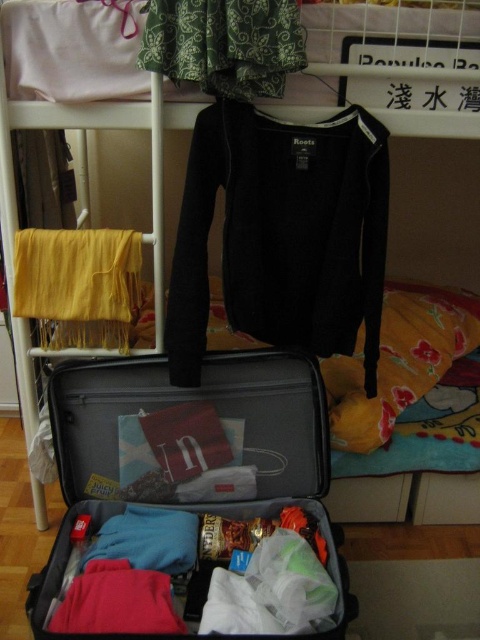
In the scene shown: You are packing your suitcase and need to know which item is shorter between the patterned fabric pants at upper center and the yellow fabric at left. Can you tell me which one is shorter?

The patterned fabric pants at upper center has a lesser height compared to yellow fabric at left, so the patterned fabric pants at upper center is shorter.

You are a delivery robot with a height of 1.2 meters. You need to deliver a package to the dorm room. The package is placed on the floor in front of the matte gray suitcase at center. Can you see the package from your current position?

The distance between the matte gray suitcase at center and the camera is 1.11 meters. Since the robot is 1.2 meters tall, it can see over the suitcase and thus see the package on the floor in front of it.

You are moving into a dormitory and need to place your belongings. You have a matte gray suitcase at center and patterned fabric pants at upper center. Which item is located below the other?

The matte gray suitcase at center is positioned under patterned fabric pants at upper center, so the suitcase is below the pants.